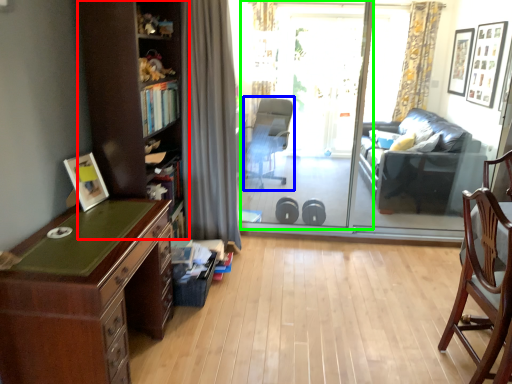
Question: Which is farther away from bookshelf (highlighted by a red box)? chair (highlighted by a blue box) or screen door (highlighted by a green box)?

Choices:
 (A) chair
 (B) screen door

Answer: (A)